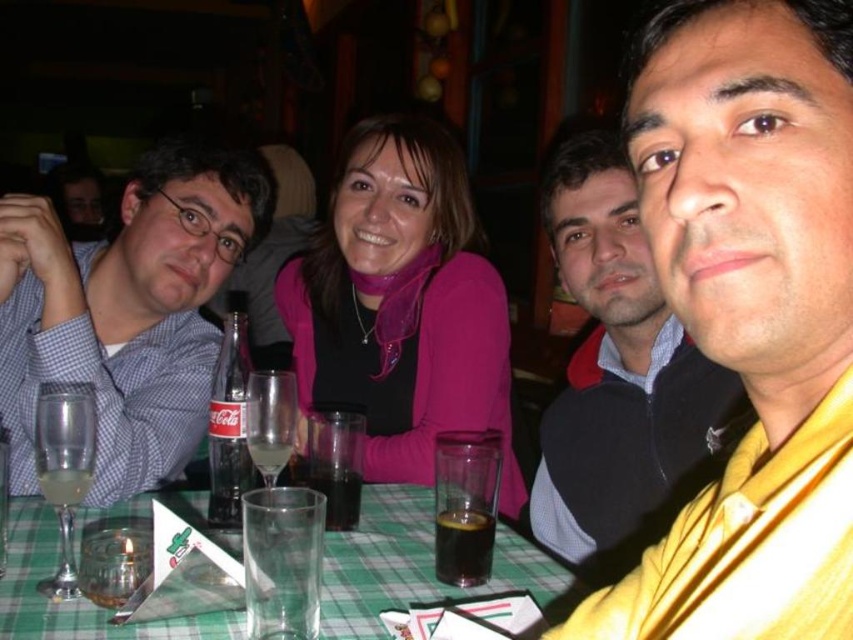
Question: Is yellow fabric at right to the left of dark brown liquid at table center from the viewer's perspective?

Choices:
 (A) yes
 (B) no

Answer: (B)

Question: Among these objects, which one is farthest from the camera?

Choices:
 (A) clear glass wine glass at lower left
 (B) yellow silk scarf at center

Answer: (A)

Question: Which of these objects is positioned farthest from the clear glass coca-cola at center?

Choices:
 (A) yellow fabric at right
 (B) yellow silk scarf at center
 (C) clear glass wine glass at center
 (D) dark brown liquid at table center

Answer: (A)

Question: Can you confirm if pink matte scarf at center is positioned to the right of yellow fabric at right?

Choices:
 (A) yes
 (B) no

Answer: (B)

Question: Can you confirm if yellow silk scarf at center is positioned to the right of clear glass wine glass at center?

Choices:
 (A) yes
 (B) no

Answer: (A)

Question: Which object appears farthest from the camera in this image?

Choices:
 (A) dark brown liquid at center
 (B) green checkered tablecloth at lower center

Answer: (A)